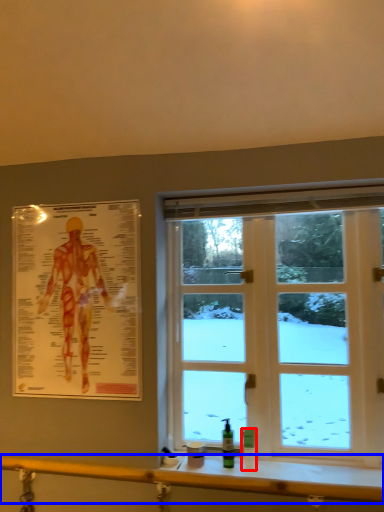
Question: Which object is closer to the camera taking this photo, toiletry (highlighted by a red box) or rail (highlighted by a blue box)?

Choices:
 (A) toiletry
 (B) rail

Answer: (B)